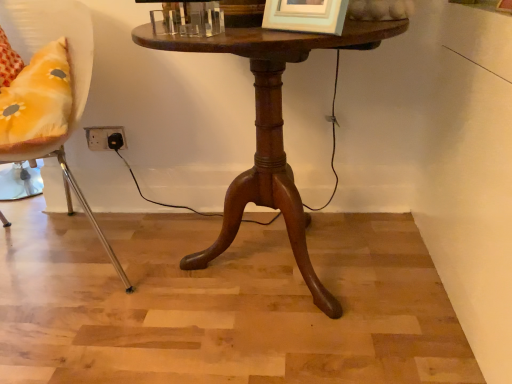
Question: Considering the positions of metallic yellow cushion at left and mahogany wood table at center in the image, is metallic yellow cushion at left taller or shorter than mahogany wood table at center?

Choices:
 (A) short
 (B) tall

Answer: (B)

Question: From the image's perspective, is metallic yellow cushion at left positioned above or below mahogany wood table at center?

Choices:
 (A) above
 (B) below

Answer: (A)

Question: Considering the relative positions of metallic yellow cushion at left and mahogany wood table at center in the image provided, is metallic yellow cushion at left to the left or to the right of mahogany wood table at center?

Choices:
 (A) left
 (B) right

Answer: (A)

Question: Visually, is mahogany wood table at center positioned to the left or to the right of metallic yellow cushion at left?

Choices:
 (A) left
 (B) right

Answer: (B)

Question: In terms of size, does mahogany wood table at center appear bigger or smaller than metallic yellow cushion at left?

Choices:
 (A) big
 (B) small

Answer: (B)

Question: Is point (224, 39) closer or farther from the camera than point (76, 41)?

Choices:
 (A) closer
 (B) farther

Answer: (A)

Question: Is mahogany wood table at center situated inside metallic yellow cushion at left or outside?

Choices:
 (A) inside
 (B) outside

Answer: (B)